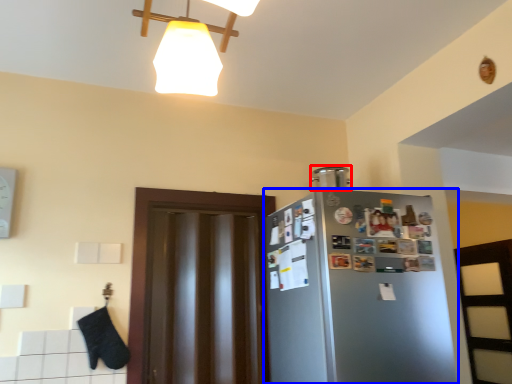
Question: Which object appears farthest to the camera in this image, appliance (highlighted by a red box) or refrigerator (highlighted by a blue box)?

Choices:
 (A) appliance
 (B) refrigerator

Answer: (A)